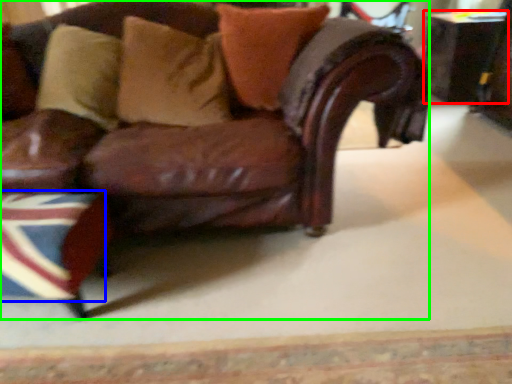
Question: Which object is positioned farthest from table (highlighted by a red box)? Select from flag (highlighted by a blue box) and chair (highlighted by a green box).

Choices:
 (A) flag
 (B) chair

Answer: (A)